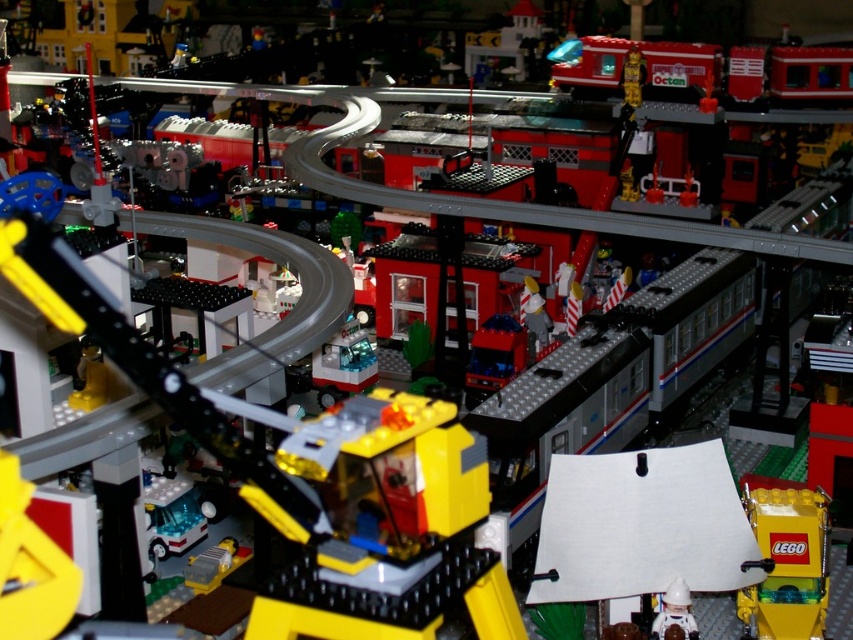
You are a visitor at the train station in the image. You want to place a small LEGO brick on the table between the yellow matte lego box at lower right and the white plastic astronaut at lower right. Is there enough space between them to fit the brick?

The yellow matte lego box at lower right is to the right of the white plastic astronaut at lower right, so there is space between them to place the small LEGO brick.

You are a delivery person who needs to place a 1.5 meter long package between the yellow matte lego box at lower right and another object. Is there enough space?

The distance between the yellow matte lego box at lower right and the other object is 1.28 meters, which is shorter than the 1.5 meter long package. The package cannot fit between them.

In the Lego diorama scene, there is a yellow matte lego box at lower right and a white plastic astronaut at lower right. Which object occupies more space in the scene?

The yellow matte lego box at lower right is larger in size than the white plastic astronaut at lower right, so it occupies more space in the scene.